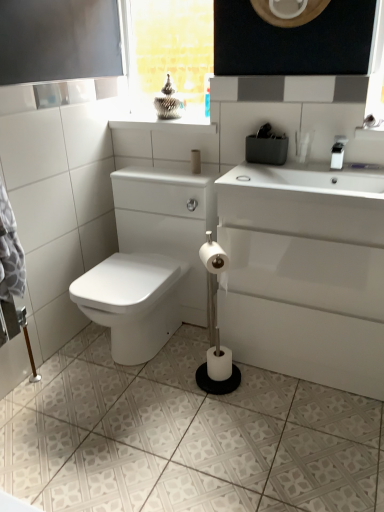
This screenshot has height=512, width=384. I want to click on free space to the left of white plastic faucet at upper right, so click(x=289, y=172).